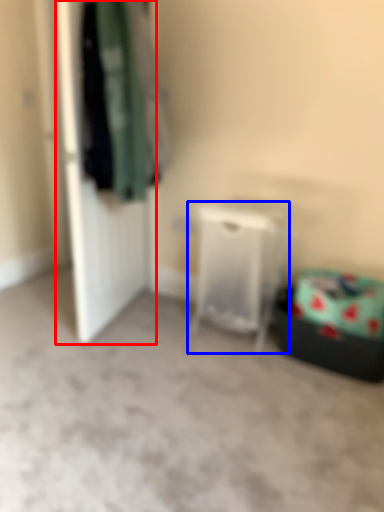
Question: Which object appears closest to the camera in this image, door (highlighted by a red box) or furniture (highlighted by a blue box)?

Choices:
 (A) door
 (B) furniture

Answer: (A)